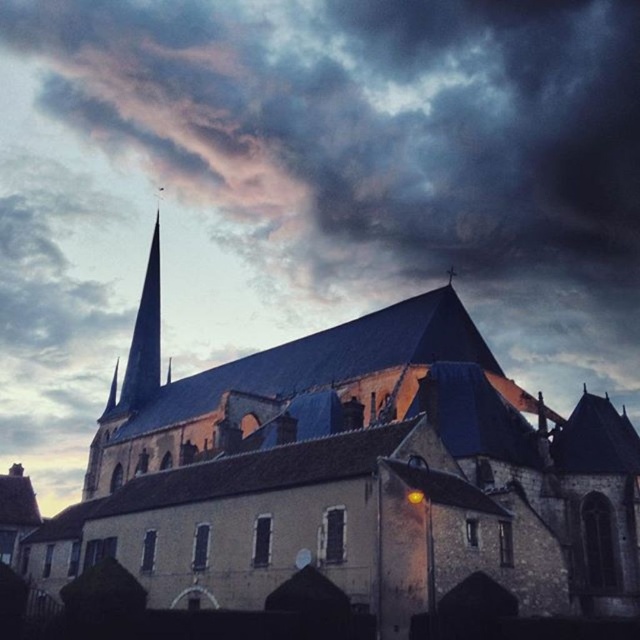
Is stone church at center to the right of smooth dark gray spire at upper left from the viewer's perspective?

Indeed, stone church at center is positioned on the right side of smooth dark gray spire at upper left.

Can you confirm if stone church at center is shorter than smooth dark gray spire at upper left?

Correct, stone church at center is not as tall as smooth dark gray spire at upper left.

At what (x,y) coordinates should I click in order to perform the action: click on stone church at center. Please return your answer as a coordinate pair (x, y). The image size is (640, 640). Looking at the image, I should click on (353, 480).

Image resolution: width=640 pixels, height=640 pixels. Find the location of `stone church at center`. stone church at center is located at coordinates (353, 480).